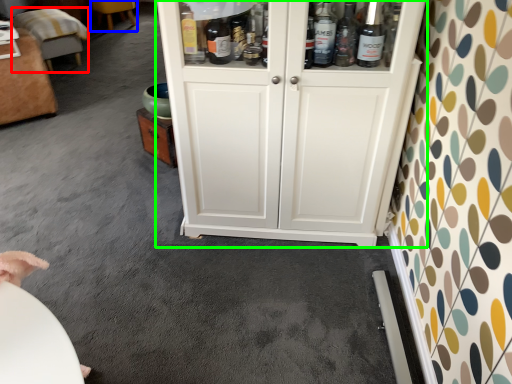
Question: Which is farther away from furniture (highlighted by a red box)? furniture (highlighted by a blue box) or cupboard (highlighted by a green box)?

Choices:
 (A) furniture
 (B) cupboard

Answer: (B)